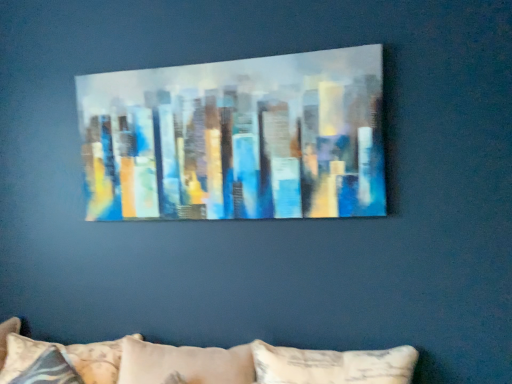
Question: Is patterned fabric pillow at lower left smaller than painted canvas cityscape at center?

Choices:
 (A) no
 (B) yes

Answer: (A)

Question: Is patterned fabric pillow at lower left placed right next to painted canvas cityscape at center?

Choices:
 (A) no
 (B) yes

Answer: (A)

Question: Can we say patterned fabric pillow at lower left lies outside painted canvas cityscape at center?

Choices:
 (A) no
 (B) yes

Answer: (B)

Question: From the image's perspective, is patterned fabric pillow at lower left above painted canvas cityscape at center?

Choices:
 (A) yes
 (B) no

Answer: (B)

Question: Is patterned fabric pillow at lower left positioned with its back to painted canvas cityscape at center?

Choices:
 (A) yes
 (B) no

Answer: (B)

Question: Can you confirm if patterned fabric pillow at lower left is positioned to the right of painted canvas cityscape at center?

Choices:
 (A) yes
 (B) no

Answer: (B)

Question: From the image's perspective, is painted canvas cityscape at center on patterned fabric pillow at lower left?

Choices:
 (A) yes
 (B) no

Answer: (A)

Question: From a real-world perspective, is painted canvas cityscape at center physically above patterned fabric pillow at lower left?

Choices:
 (A) yes
 (B) no

Answer: (A)

Question: From a real-world perspective, is painted canvas cityscape at center below patterned fabric pillow at lower left?

Choices:
 (A) no
 (B) yes

Answer: (A)

Question: Are painted canvas cityscape at center and patterned fabric pillow at lower left far apart?

Choices:
 (A) no
 (B) yes

Answer: (A)

Question: Could you tell me if painted canvas cityscape at center is facing patterned fabric pillow at lower left?

Choices:
 (A) no
 (B) yes

Answer: (A)

Question: Would you say patterned fabric pillow at lower left is part of painted canvas cityscape at center's contents?

Choices:
 (A) yes
 (B) no

Answer: (B)

Question: Choose the correct answer: Is patterned fabric pillow at lower left inside painted canvas cityscape at center or outside it?

Choices:
 (A) inside
 (B) outside

Answer: (B)